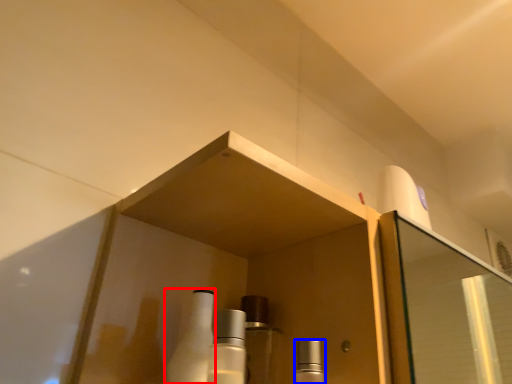
Question: Which point is closer to the camera, bottle (highlighted by a red box) or mouthwash (highlighted by a blue box)?

Choices:
 (A) bottle
 (B) mouthwash

Answer: (B)